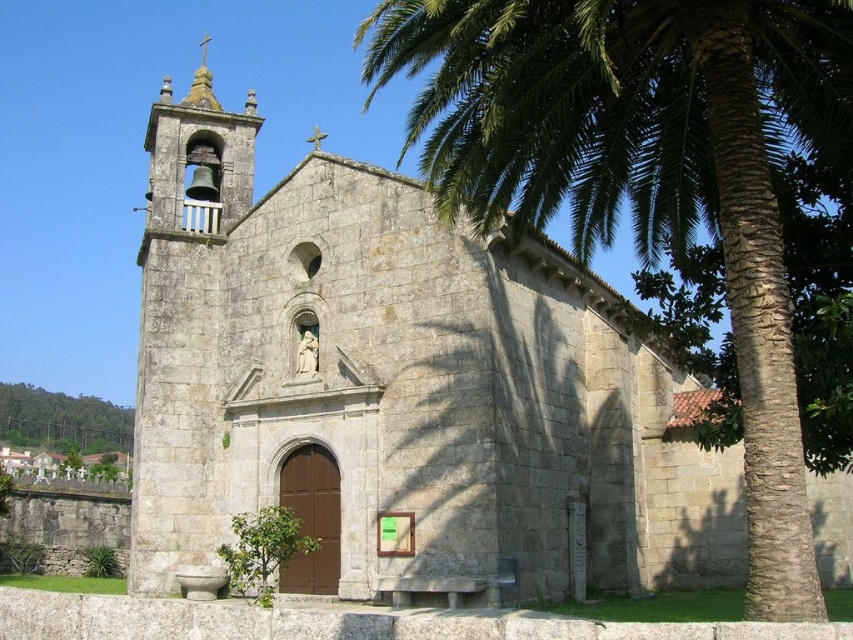
You are standing at the point marked by the coordinates point (647, 172) in the image. Looking around, you see the church and its bell tower. What do you see directly in front of you?

The point (647, 172) marks the green leafy palm tree at center, so directly in front of you would be the green leafy palm tree at center.

You are standing in front of the church and want to take a photo that includes both the green leafy palm tree at center and the green leafy tree at upper left. Which tree should you focus on to ensure both are fully visible in the frame?

The green leafy palm tree at center is taller than the green leafy tree at upper left, so focusing on the taller palm tree at center will ensure both trees are fully visible in the frame.